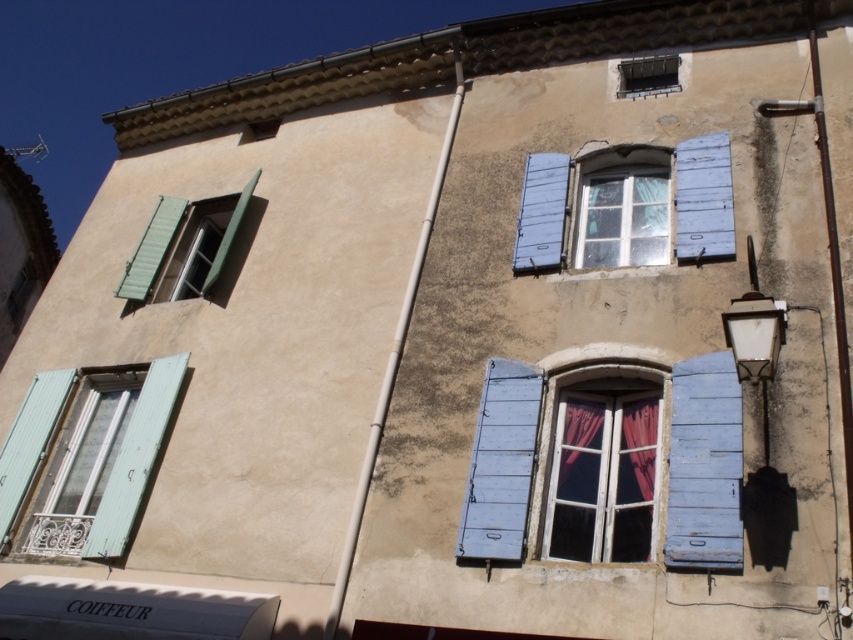
Can you confirm if matte green shutter at left is positioned below metallic gray window at upper center?

Yes, matte green shutter at left is below metallic gray window at upper center.

At what (x,y) coordinates should I click in order to perform the action: click on matte green shutter at left. Please return your answer as a coordinate pair (x, y). Looking at the image, I should click on (28, 440).

This screenshot has height=640, width=853. Find the location of `matte green shutter at left`. matte green shutter at left is located at coordinates (28, 440).

Can you confirm if blue wooden shutters at center is positioned to the left of matte green shutters at left?

No, blue wooden shutters at center is not to the left of matte green shutters at left.

Is point (553, 216) less distant than point (178, 296)?

Yes, point (553, 216) is closer to viewer.

Who is more distant from viewer, (x=705, y=141) or (x=195, y=273)?

Point (x=195, y=273)

Where is `blue wooden shutters at center`? This screenshot has width=853, height=640. blue wooden shutters at center is located at coordinates (703, 196).

Image resolution: width=853 pixels, height=640 pixels. I want to click on blue painted wood window at center, so click(x=704, y=465).

Does blue painted wood window at center appear under blue wooden shutters at center?

Yes.

Identify the location of blue painted wood window at center. (704, 465).